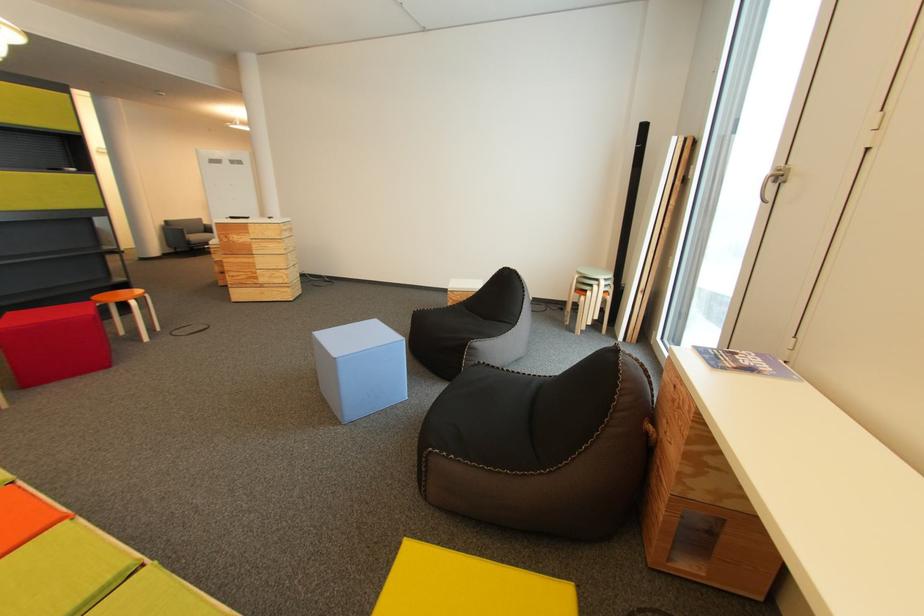
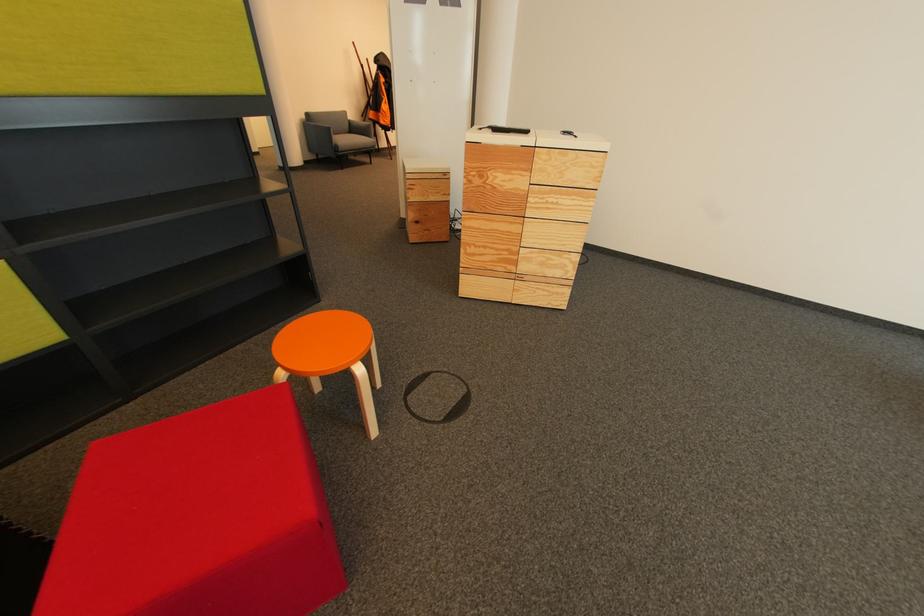
What movement of the cameraman would produce the second image?

The movement direction of the cameraman is left, forward.